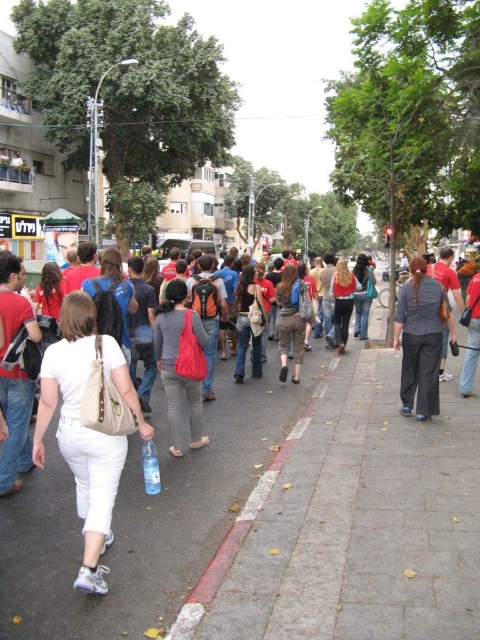
Is white fabric bag at center above matte red bag at center?

Actually, white fabric bag at center is below matte red bag at center.

Is point (66, 298) more distant than point (189, 404)?

No, it is in front of (189, 404).

Locate an element on the screen. This screenshot has width=480, height=640. white fabric bag at center is located at coordinates (80, 435).